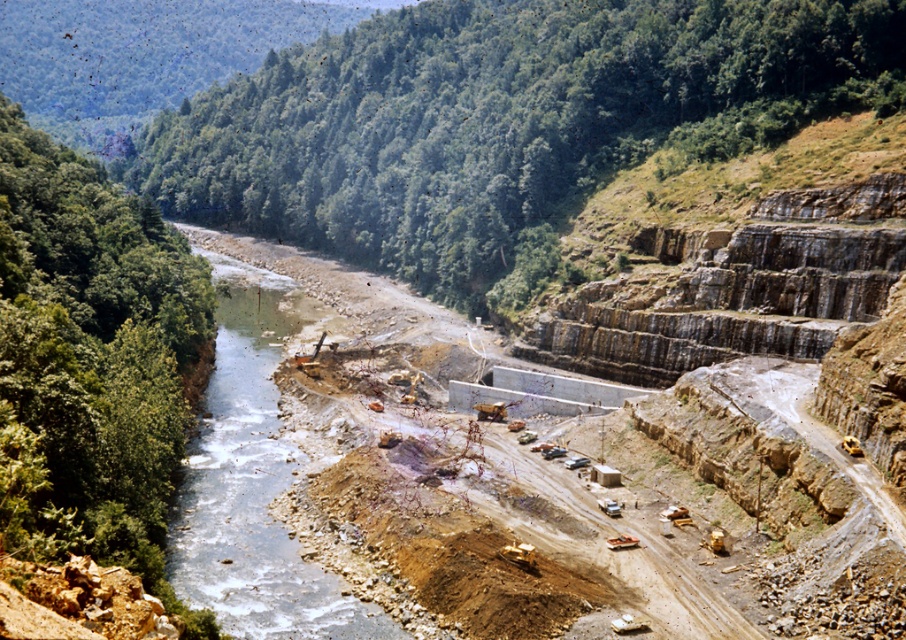
Can you confirm if clear water at center is positioned to the left of brown rocky construction site at center?

Yes, clear water at center is to the left of brown rocky construction site at center.

In the scene shown: Is the position of clear water at center more distant than that of brown rocky construction site at center?

Yes.

Describe the element at coordinates (254, 472) in the screenshot. I see `clear water at center` at that location.

What are the coordinates of `clear water at center` in the screenshot? It's located at (254, 472).